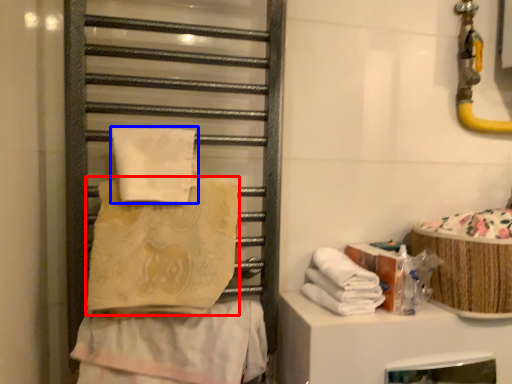
Question: Which point is further to the camera, towel (highlighted by a red box) or towel (highlighted by a blue box)?

Choices:
 (A) towel
 (B) towel

Answer: (B)